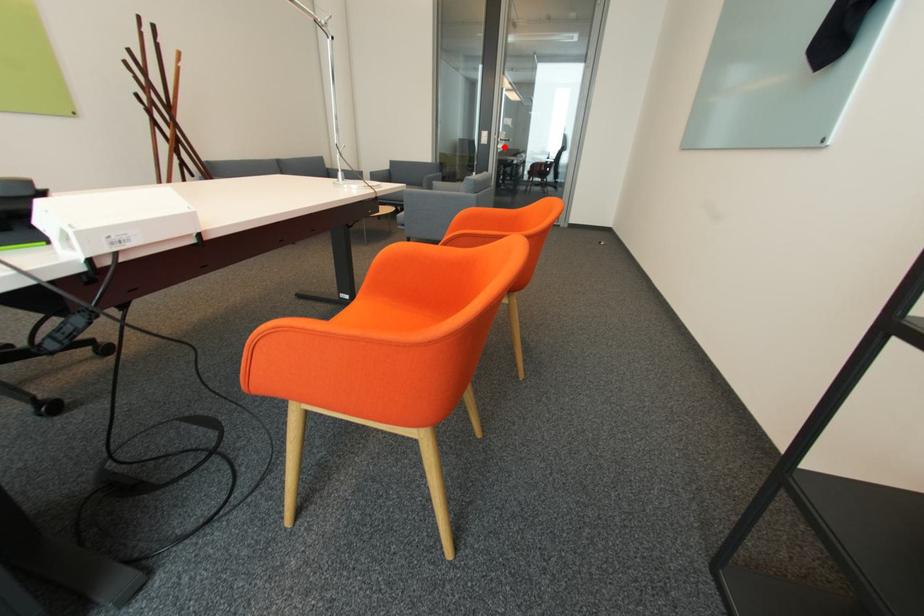
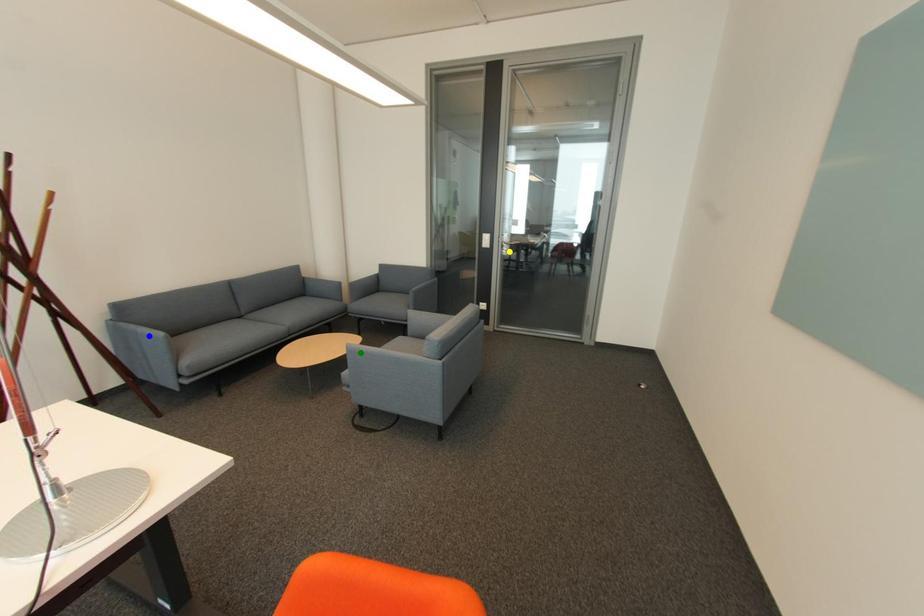
Question: I am providing you with two images of the same scene from different viewpoints. A red point is marked on the first image. You are given multiple points on the second image. Which point in image 2 represents the same 3d spot as the red point in image 1?

Choices:
 (A) blue point
 (B) yellow point
 (C) green point

Answer: (B)